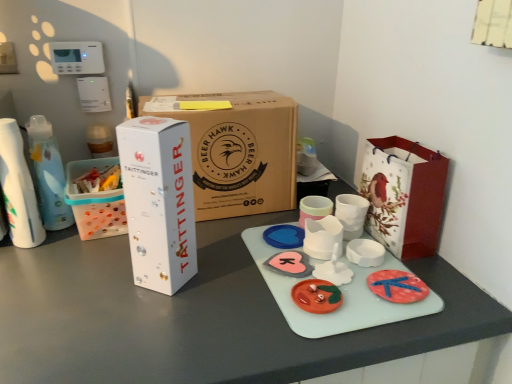
In order to click on free space in front of pink matte heart at center, arranged as the 2th toy when viewed from the back in this screenshot , I will do `click(286, 316)`.